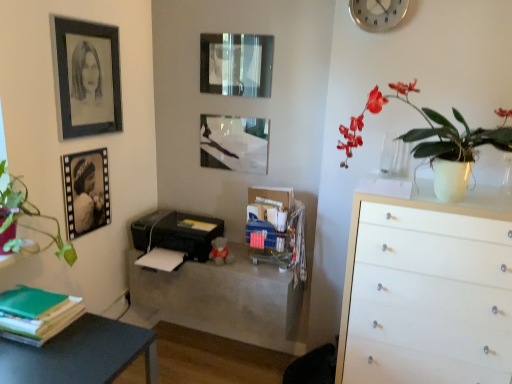
Question: Is matte black picture frame at center, which is counted as the 3th picture frame, starting from the left, placed right next to matte white vase at upper right?

Choices:
 (A) yes
 (B) no

Answer: (B)

Question: Considering the relative sizes of matte black picture frame at center, which appears as the second picture frame when viewed from the right, and matte white vase at upper right in the image provided, is matte black picture frame at center, which appears as the second picture frame when viewed from the right, taller than matte white vase at upper right?

Choices:
 (A) no
 (B) yes

Answer: (A)

Question: Can you confirm if matte black picture frame at center, which is counted as the 3th picture frame, starting from the left, is positioned to the left of matte white vase at upper right?

Choices:
 (A) yes
 (B) no

Answer: (A)

Question: Is matte black picture frame at center, which is counted as the 3th picture frame, starting from the left, at the right side of matte white vase at upper right?

Choices:
 (A) yes
 (B) no

Answer: (B)

Question: Can you confirm if matte black picture frame at center, which appears as the second picture frame when viewed from the right, is smaller than matte white vase at upper right?

Choices:
 (A) no
 (B) yes

Answer: (B)

Question: In terms of width, does silver metallic clock at upper right look wider or thinner when compared to matte black picture frame at upper center, placed as the first picture frame when sorted from right to left?

Choices:
 (A) thin
 (B) wide

Answer: (B)

Question: Visually, is silver metallic clock at upper right positioned to the left or to the right of matte black picture frame at upper center, placed as the first picture frame when sorted from right to left?

Choices:
 (A) right
 (B) left

Answer: (A)

Question: Is silver metallic clock at upper right spatially inside matte black picture frame at upper center, marked as the fourth picture frame in a left-to-right arrangement, or outside of it?

Choices:
 (A) outside
 (B) inside

Answer: (A)

Question: From a real-world perspective, is silver metallic clock at upper right above or below matte black picture frame at upper center, marked as the fourth picture frame in a left-to-right arrangement?

Choices:
 (A) above
 (B) below

Answer: (A)

Question: Is silver metallic clock at upper right in front of or behind black plastic printer at center in the image?

Choices:
 (A) behind
 (B) front

Answer: (B)

Question: In terms of height, does silver metallic clock at upper right look taller or shorter compared to black plastic printer at center?

Choices:
 (A) short
 (B) tall

Answer: (B)

Question: Looking at their shapes, would you say silver metallic clock at upper right is wider or thinner than black plastic printer at center?

Choices:
 (A) wide
 (B) thin

Answer: (B)

Question: Looking at the image, does silver metallic clock at upper right seem bigger or smaller compared to black plastic printer at center?

Choices:
 (A) small
 (B) big

Answer: (A)

Question: From the image's perspective, is green matte book at lower left positioned above or below matte black printer at center?

Choices:
 (A) above
 (B) below

Answer: (A)

Question: Does point (28, 337) appear closer or farther from the camera than point (132, 301)?

Choices:
 (A) farther
 (B) closer

Answer: (B)